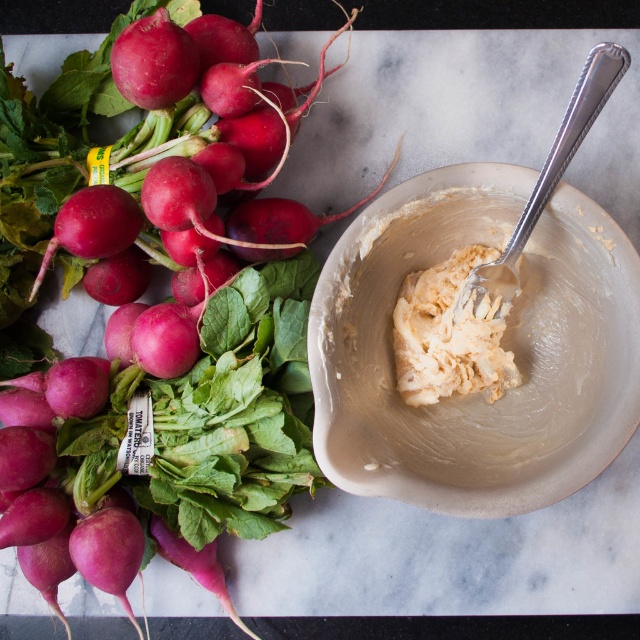
Question: Is smooth red radish at left below white creamy paste at center?

Choices:
 (A) no
 (B) yes

Answer: (A)

Question: Is smooth red radish at left below silver textured spoon at upper right?

Choices:
 (A) yes
 (B) no

Answer: (A)

Question: Which object is positioned farthest from the white creamy paste at center?

Choices:
 (A) silver textured spoon at upper right
 (B) smooth red radish at left

Answer: (B)

Question: Which object is the farthest from the white creamy paste at center?

Choices:
 (A) smooth red radish at left
 (B) silver textured spoon at upper right

Answer: (A)

Question: Can you confirm if smooth red radish at left is positioned above silver textured spoon at upper right?

Choices:
 (A) yes
 (B) no

Answer: (B)

Question: Estimate the real-world distances between objects in this image. Which object is closer to the smooth red radish at left?

Choices:
 (A) white creamy paste at center
 (B) silver textured spoon at upper right

Answer: (A)